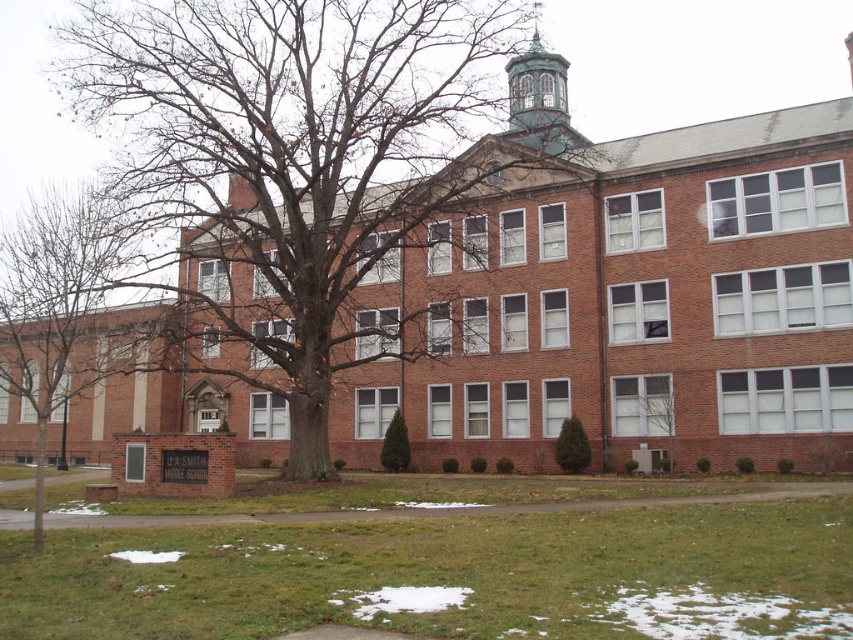
You are standing in front of Smith Middle School during winter. You see a green textured shrub at center and a green textured evergreen at center. Which one is closer to you?

Both the green textured shrub at center and the green textured evergreen at center are at the same distance from you since they are both positioned at the center.

You are a student arriving at SMITH MIDDLE SCHOOL in winter. You notice two trees in front of the school. Which tree has a thicker trunk, the green leafy tree at center or the green textured evergreen at center?

The green textured evergreen at center has a thicker trunk because the green leafy tree at center is thinner than it.